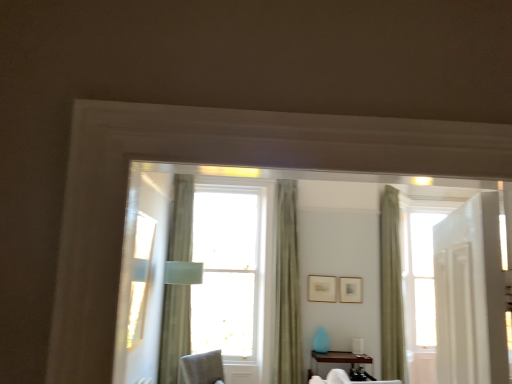
Question: Is green fabric curtain at center, the 2th curtain in the left-to-right sequence, taller than brown wood table at lower center?

Choices:
 (A) yes
 (B) no

Answer: (A)

Question: Is green fabric curtain at center, the 2th curtain in the left-to-right sequence, far away from brown wood table at lower center?

Choices:
 (A) no
 (B) yes

Answer: (A)

Question: From a real-world perspective, does green fabric curtain at center, which is the second curtain from right to left, sit lower than brown wood table at lower center?

Choices:
 (A) yes
 (B) no

Answer: (B)

Question: Is green fabric curtain at center, which is the second curtain from right to left, at the left side of brown wood table at lower center?

Choices:
 (A) yes
 (B) no

Answer: (A)

Question: Is green fabric curtain at center, which is the second curtain from right to left, oriented away from brown wood table at lower center?

Choices:
 (A) yes
 (B) no

Answer: (B)

Question: Does green fabric curtain at center, the 2th curtain in the left-to-right sequence, lie in front of brown wood table at lower center?

Choices:
 (A) no
 (B) yes

Answer: (A)

Question: From a real-world perspective, is transparent glass window at center below green fabric curtain at right, which appears as the first curtain when viewed from the right?

Choices:
 (A) no
 (B) yes

Answer: (A)

Question: Is transparent glass window at center at the right side of green fabric curtain at right, which appears as the first curtain when viewed from the right?

Choices:
 (A) yes
 (B) no

Answer: (B)

Question: Does transparent glass window at center have a lesser height compared to green fabric curtain at right, the 3th curtain from the left?

Choices:
 (A) yes
 (B) no

Answer: (A)

Question: Is transparent glass window at center wider than green fabric curtain at right, the 3th curtain from the left?

Choices:
 (A) no
 (B) yes

Answer: (A)

Question: Does transparent glass window at center contain green fabric curtain at right, which appears as the first curtain when viewed from the right?

Choices:
 (A) yes
 (B) no

Answer: (B)

Question: Does transparent glass window at center appear on the left side of green fabric curtain at right, the 3th curtain from the left?

Choices:
 (A) yes
 (B) no

Answer: (A)

Question: Is transparent glass window at center at the back of light beige fabric curtain at center, placed as the 3th curtain when sorted from right to left?

Choices:
 (A) yes
 (B) no

Answer: (A)